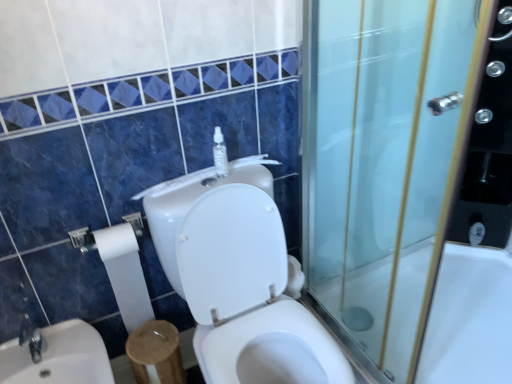
Question: Considering their positions, is white glossy toilet at center located in front of or behind white glossy sink at lower left?

Choices:
 (A) front
 (B) behind

Answer: (A)

Question: Is point (243, 269) closer or farther from the camera than point (75, 362)?

Choices:
 (A) farther
 (B) closer

Answer: (A)

Question: Which object is the farthest from the white glossy toilet at center?

Choices:
 (A) white glossy bathtub at right
 (B) clear plastic bottle at upper center
 (C) white glossy sink at lower left
 (D) transparent glass screen door at right
 (E) white paper at left

Answer: (A)

Question: Which object is the closest to the white glossy bathtub at right?

Choices:
 (A) white glossy toilet at center
 (B) white glossy sink at lower left
 (C) clear plastic bottle at upper center
 (D) transparent glass screen door at right
 (E) white paper at left

Answer: (D)